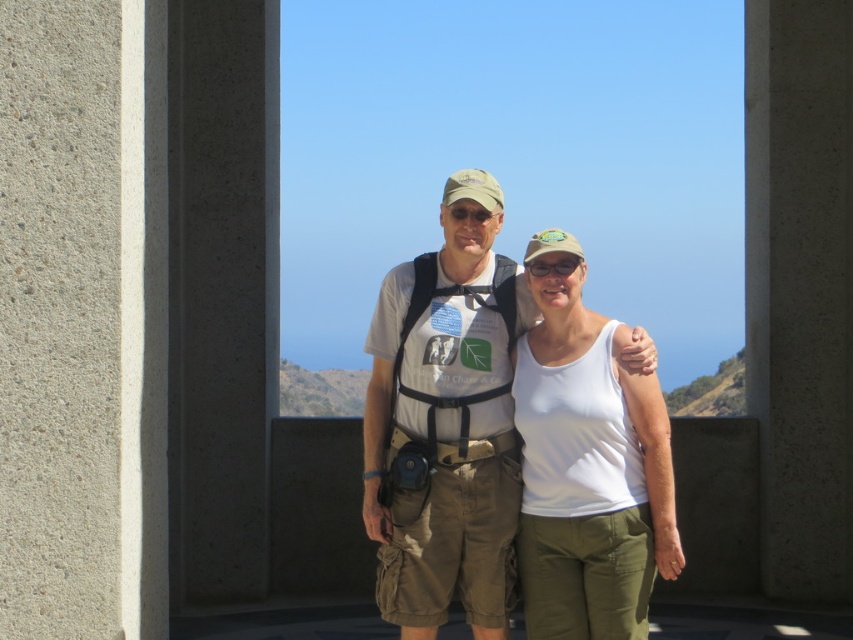
Question: Among these points, which one is farthest from the camera?

Choices:
 (A) (631, 513)
 (B) (491, 252)
 (C) (799, 476)

Answer: (C)

Question: Can you confirm if matte white t-shirt at center is wider than white cotton tank top at center?

Choices:
 (A) yes
 (B) no

Answer: (A)

Question: Which of the following is the closest to the observer?

Choices:
 (A) (573, 337)
 (B) (428, 401)

Answer: (A)

Question: Which object is the closest to the white cotton tank top at center?

Choices:
 (A) gray concrete pillar at center
 (B) matte white t-shirt at center

Answer: (B)

Question: Is gray concrete pillar at center to the left of white cotton tank top at center from the viewer's perspective?

Choices:
 (A) yes
 (B) no

Answer: (B)

Question: Is gray concrete pillar at center bigger than matte white t-shirt at center?

Choices:
 (A) yes
 (B) no

Answer: (A)